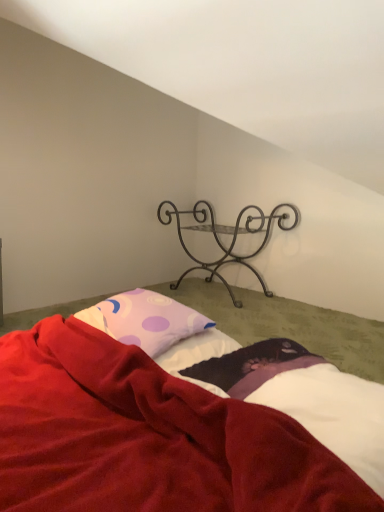
Question: Is purple dotted pillow at center smaller than metallic wrought iron shelf at upper center?

Choices:
 (A) yes
 (B) no

Answer: (A)

Question: From the image's perspective, does purple dotted pillow at center appear higher than metallic wrought iron shelf at upper center?

Choices:
 (A) yes
 (B) no

Answer: (B)

Question: Does purple dotted pillow at center have a greater height compared to metallic wrought iron shelf at upper center?

Choices:
 (A) yes
 (B) no

Answer: (B)

Question: Is the position of purple dotted pillow at center more distant than that of metallic wrought iron shelf at upper center?

Choices:
 (A) no
 (B) yes

Answer: (A)

Question: Is purple dotted pillow at center looking in the opposite direction of metallic wrought iron shelf at upper center?

Choices:
 (A) yes
 (B) no

Answer: (B)

Question: Does purple dotted pillow at center have a greater width compared to metallic wrought iron shelf at upper center?

Choices:
 (A) no
 (B) yes

Answer: (A)

Question: From a real-world perspective, is velvet red blanket at lower center physically below white soft sheet at lower right?

Choices:
 (A) no
 (B) yes

Answer: (B)

Question: Is velvet red blanket at lower center aimed at white soft sheet at lower right?

Choices:
 (A) yes
 (B) no

Answer: (B)

Question: Can white soft sheet at lower right be found inside velvet red blanket at lower center?

Choices:
 (A) yes
 (B) no

Answer: (A)

Question: Does velvet red blanket at lower center touch white soft sheet at lower right?

Choices:
 (A) no
 (B) yes

Answer: (A)

Question: Can you confirm if velvet red blanket at lower center is positioned to the right of white soft sheet at lower right?

Choices:
 (A) yes
 (B) no

Answer: (B)

Question: Can we say velvet red blanket at lower center lies outside white soft sheet at lower right?

Choices:
 (A) yes
 (B) no

Answer: (A)

Question: From the image's perspective, is metallic wrought iron shelf at upper center beneath purple dotted pillow at center?

Choices:
 (A) yes
 (B) no

Answer: (B)